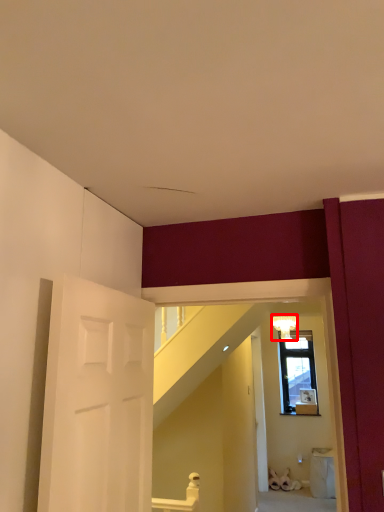
Question: Where is light fixture (annotated by the red box) located in relation to door in the image?

Choices:
 (A) left
 (B) right

Answer: (B)